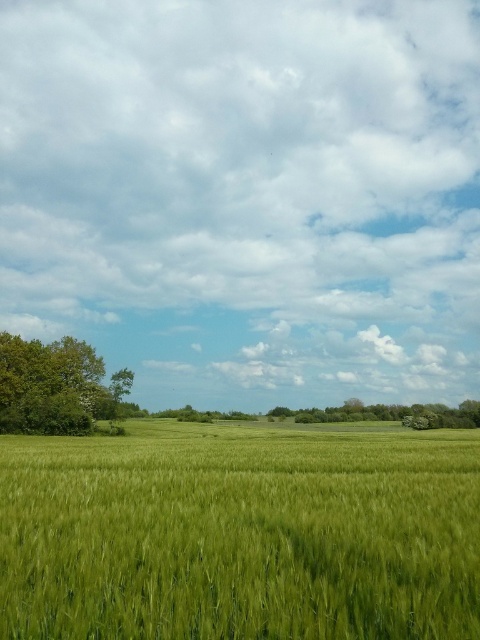
Can you confirm if cloudy sky at upper center is positioned to the left of green leafy tree at center?

Indeed, cloudy sky at upper center is positioned on the left side of green leafy tree at center.

Can you confirm if cloudy sky at upper center is smaller than green leafy tree at center?

Incorrect, cloudy sky at upper center is not smaller in size than green leafy tree at center.

Describe the element at coordinates (245, 195) in the screenshot. The image size is (480, 640). I see `cloudy sky at upper center` at that location.

At what (x,y) coordinates should I click in order to perform the action: click on cloudy sky at upper center. Please return your answer as a coordinate pair (x, y). This screenshot has height=640, width=480. Looking at the image, I should click on (245, 195).

Does green grassy wheat field at center have a greater width compared to green leafy tree at left?

Yes, green grassy wheat field at center is wider than green leafy tree at left.

This screenshot has height=640, width=480. Describe the element at coordinates (240, 532) in the screenshot. I see `green grassy wheat field at center` at that location.

What are the coordinates of `green grassy wheat field at center` in the screenshot? It's located at (240, 532).

Is cloudy sky at upper center to the right of green leafy tree at left from the viewer's perspective?

Correct, you'll find cloudy sky at upper center to the right of green leafy tree at left.

Who is lower down, cloudy sky at upper center or green leafy tree at left?

green leafy tree at left is lower down.

Locate an element on the screen. Image resolution: width=480 pixels, height=640 pixels. cloudy sky at upper center is located at coordinates (245, 195).